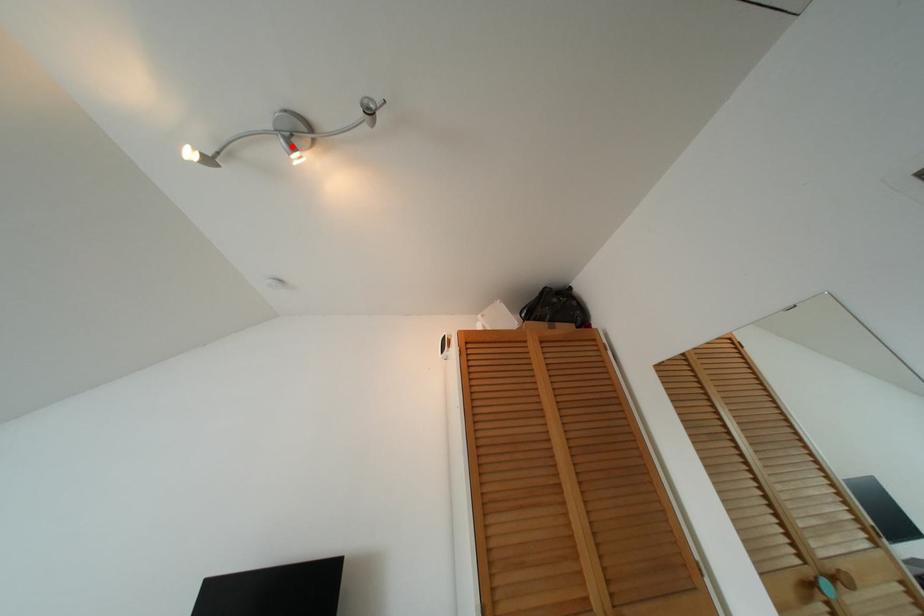
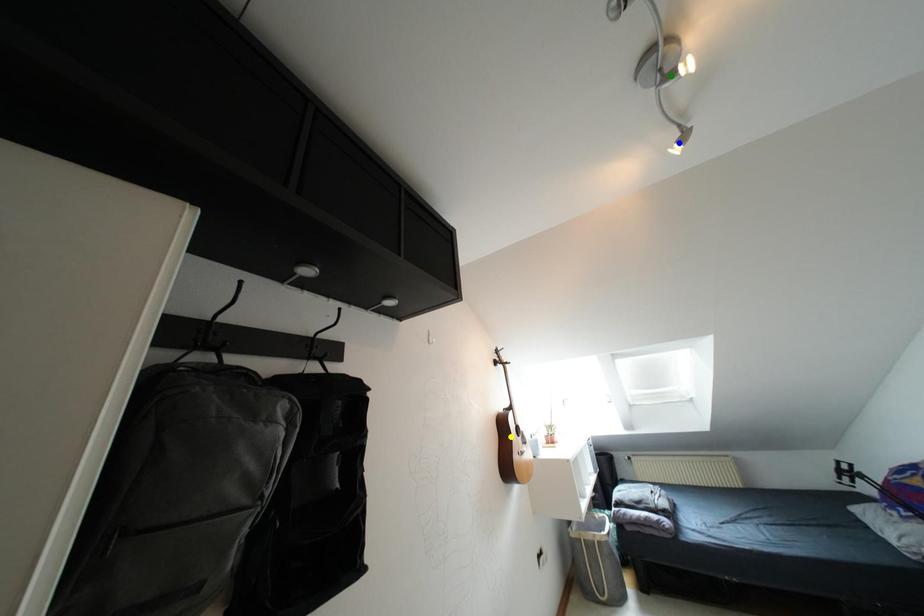
Question: I am providing you with two images of the same scene from different viewpoints. A red point is marked on the first image. You are given multiple points on the second image. In image 2, which mark is for the same physical point as the one in image 1?

Choices:
 (A) yellow point
 (B) blue point
 (C) green point

Answer: (C)